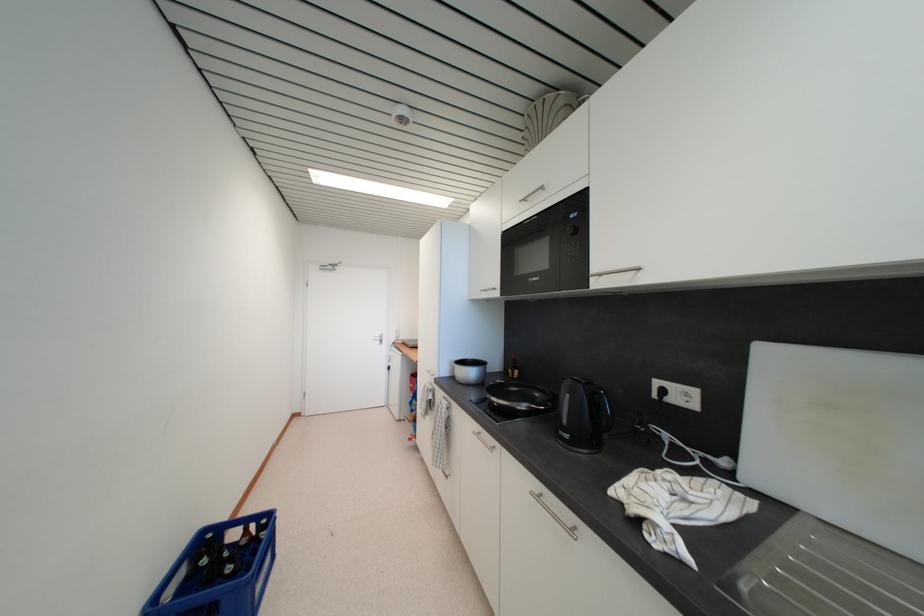
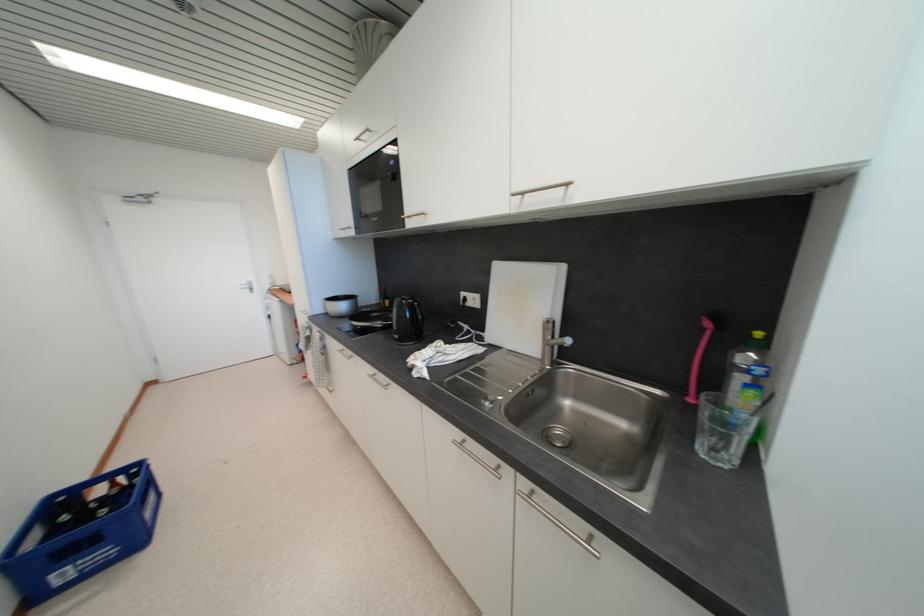
The point at (479, 398) is marked in the first image. Where is the corresponding point in the second image?

(351, 328)